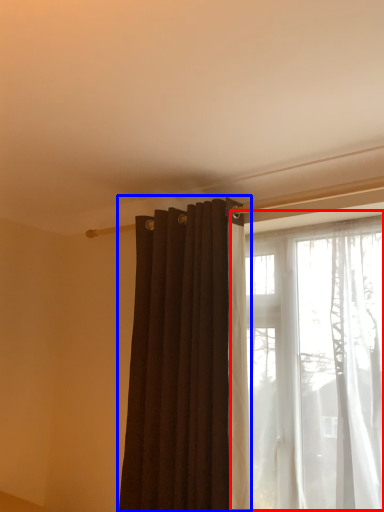
Question: Which object appears farthest to the camera in this image, window (highlighted by a red box) or curtain (highlighted by a blue box)?

Choices:
 (A) window
 (B) curtain

Answer: (B)